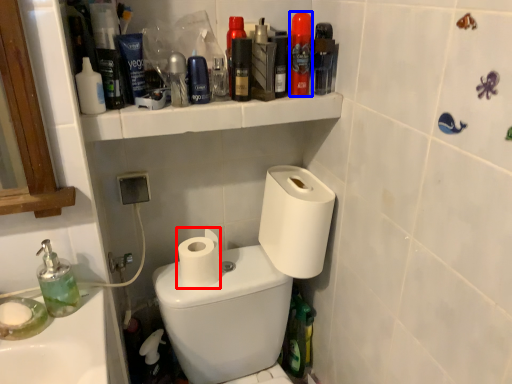
Question: Which object appears farthest to the camera in this image, toilet paper (highlighted by a red box) or mouthwash (highlighted by a blue box)?

Choices:
 (A) toilet paper
 (B) mouthwash

Answer: (A)